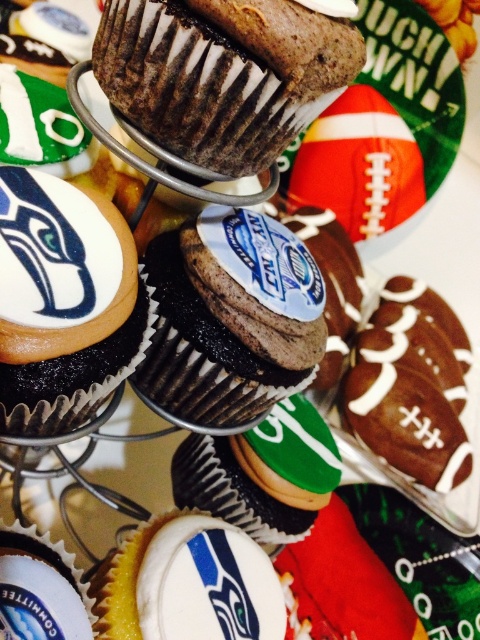
Question: Can you confirm if chocolate frosted cupcake at center is positioned above white glossy cupcake at center?

Choices:
 (A) no
 (B) yes

Answer: (B)

Question: Estimate the real-world distances between objects in this image. Which object is farther from the chocolate frosted cupcake at center?

Choices:
 (A) matte chocolate cupcake at center
 (B) white glossy cupcake at center
 (C) chocolate matte cupcake at center

Answer: (C)

Question: Among these objects, which one is nearest to the camera?

Choices:
 (A) chocolate matte cupcake at center
 (B) chocolate frosted cupcake at center
 (C) white glossy cupcake at center

Answer: (A)

Question: Which point is farther to the camera?

Choices:
 (A) (76, 604)
 (B) (60, 186)
 (C) (190, 465)

Answer: (C)

Question: Is matte chocolate cupcake at center to the right of white glossy cupcake at center from the viewer's perspective?

Choices:
 (A) no
 (B) yes

Answer: (B)

Question: Does chocolatesmoothcupcake at center have a lesser width compared to white glossy cupcake at center?

Choices:
 (A) no
 (B) yes

Answer: (A)